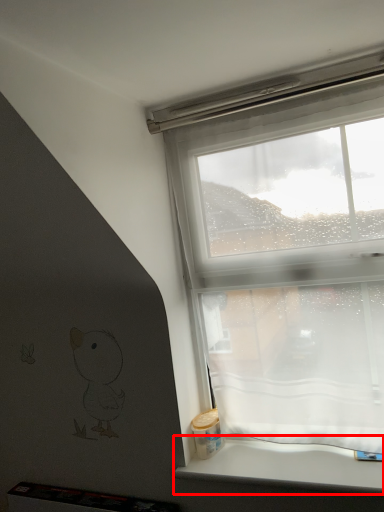
Question: From the image's perspective, what is the correct spatial positioning of window sill (annotated by the red box) in reference to window?

Choices:
 (A) above
 (B) below

Answer: (B)